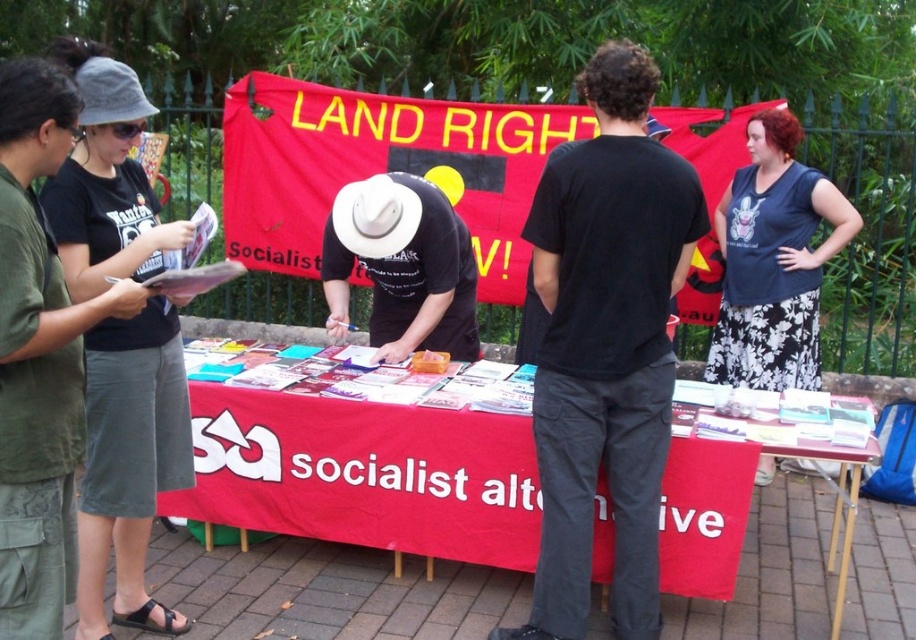
Question: Which object appears farthest from the camera in this image?

Choices:
 (A) black cotton t-shirt at left
 (B) red fabric table at center
 (C) black cotton shirt at center

Answer: (B)

Question: Is black cotton shirt at center closer to the viewer compared to white matte cowboy hat at center?

Choices:
 (A) yes
 (B) no

Answer: (A)

Question: Which object is closer to the camera taking this photo?

Choices:
 (A) black cotton shirt at center
 (B) white matte cowboy hat at center
 (C) black cotton t-shirt at left

Answer: (C)

Question: Is black cotton shirt at center below dark blue jersey at center?

Choices:
 (A) no
 (B) yes

Answer: (B)

Question: Can you confirm if black cotton shirt at center is thinner than black cotton t-shirt at left?

Choices:
 (A) yes
 (B) no

Answer: (B)

Question: Which point is closer to the camera taking this photo?

Choices:
 (A) (88, 344)
 (B) (285, 500)

Answer: (A)